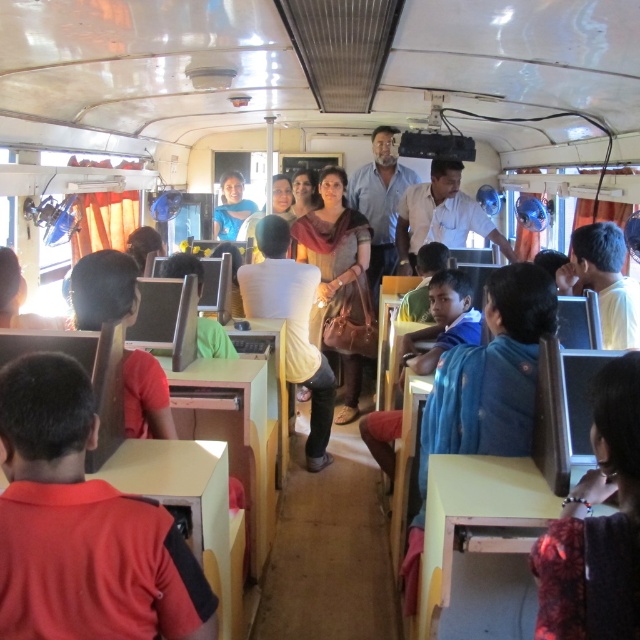
Question: Estimate the real-world distances between objects in this image. Which object is closer to the red matte shirt at lower left?

Choices:
 (A) dark red fabric at center
 (B) blue fabric coach at center

Answer: (A)

Question: Is red matte shirt at lower left bigger than dark red fabric at center?

Choices:
 (A) yes
 (B) no

Answer: (A)

Question: Which object is the closest to the dark red fabric at center?

Choices:
 (A) blue fabric coach at center
 (B) red matte shirt at lower left

Answer: (B)

Question: From the image, what is the correct spatial relationship of red matte shirt at lower left in relation to blue fabric coach at center?

Choices:
 (A) above
 (B) below

Answer: (B)

Question: Which of the following is the farthest from the observer?

Choices:
 (A) dark red fabric at center
 (B) blue fabric coach at center
 (C) red matte shirt at lower left

Answer: (B)

Question: Does dark red fabric at center have a lesser width compared to blue fabric coach at center?

Choices:
 (A) yes
 (B) no

Answer: (A)